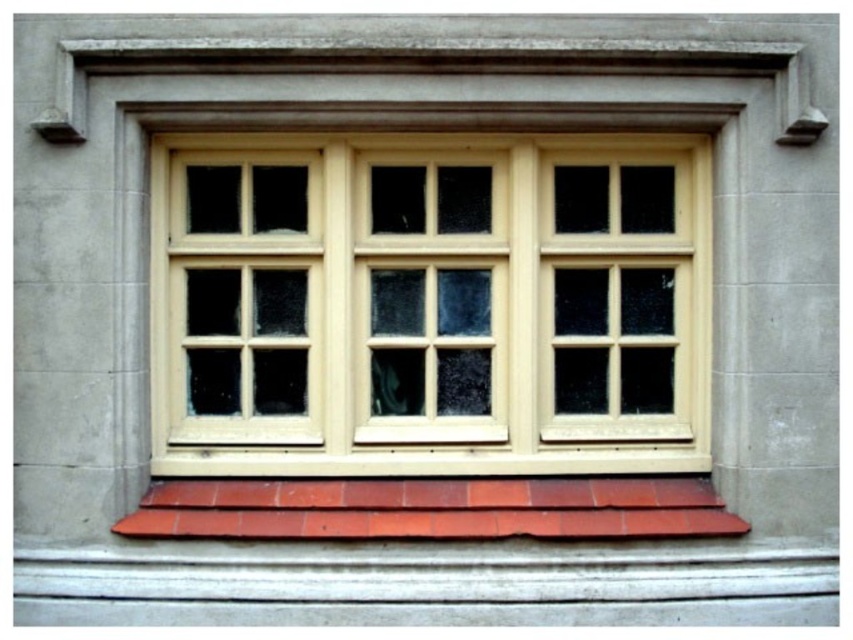
Question: Which point is farther from the camera taking this photo?

Choices:
 (A) (627, 168)
 (B) (614, 488)

Answer: (A)

Question: Does matte wood window frame at center appear under smooth terracotta tiles at bottom?

Choices:
 (A) yes
 (B) no

Answer: (B)

Question: Is matte wood window frame at center closer to the viewer compared to smooth terracotta tiles at bottom?

Choices:
 (A) yes
 (B) no

Answer: (B)

Question: Is matte wood window frame at center in front of smooth terracotta tiles at bottom?

Choices:
 (A) no
 (B) yes

Answer: (A)